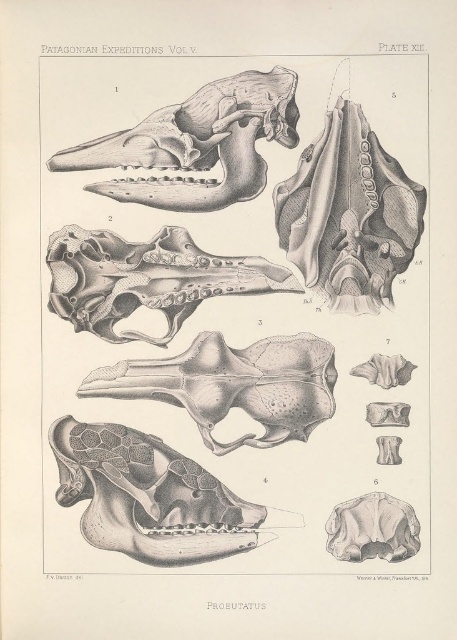
Question: Can you confirm if smooth gray skull at lower left is bigger than gray bone skull at center?

Choices:
 (A) no
 (B) yes

Answer: (B)

Question: Is the position of smooth gray skull at lower left less distant than that of gray/smooth skull at center?

Choices:
 (A) yes
 (B) no

Answer: (A)

Question: Which object is positioned farthest from the gray textured skull at center?

Choices:
 (A) gray bone skull at center
 (B) gray bone skull at upper center

Answer: (B)

Question: Which is farther from the smooth gray skull at lower left?

Choices:
 (A) gray bone skull at center
 (B) gray bone skull at upper center
 (C) gray/smooth skull at center

Answer: (B)

Question: Is gray textured skull at center further to camera compared to gray/smooth skull at center?

Choices:
 (A) yes
 (B) no

Answer: (B)

Question: Which point is closer to the camera taking this photo?

Choices:
 (A) (118, 364)
 (B) (340, 522)
 (C) (58, 241)
 (D) (123, 506)

Answer: (D)